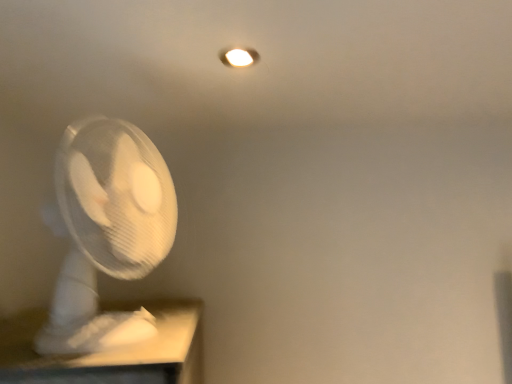
You are a GUI agent. You are given a task and a screenshot of the screen. Output one action in this format:
    pyautogui.click(x=<x>, y=<y>)
    Task: Click on the white plastic fan at lower left
    The width and height of the screenshot is (512, 384).
    Given the screenshot: What is the action you would take?
    pyautogui.click(x=106, y=231)

The width and height of the screenshot is (512, 384). What do you see at coordinates (106, 231) in the screenshot?
I see `white plastic fan at lower left` at bounding box center [106, 231].

At what (x,y) coordinates should I click in order to perform the action: click on white plastic fan at lower left. Please return your answer as a coordinate pair (x, y). The width and height of the screenshot is (512, 384). Looking at the image, I should click on (106, 231).